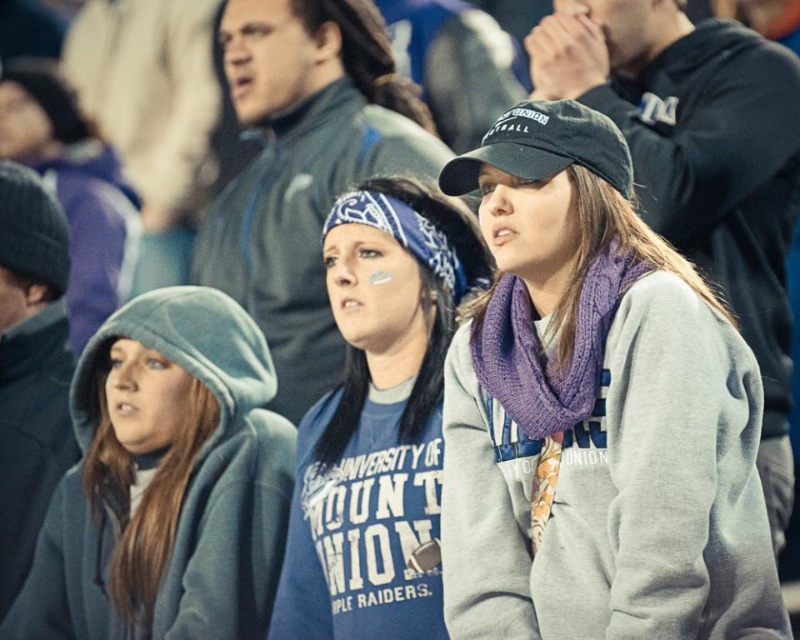
You are a photographer trying to capture a candid shot of the two women in the foreground. You notice a purple knit scarf at center and a blue fabric shirt at center. Which item should you focus on if you want to ensure the subject fills the frame without cropping, considering their widths?

The purple knit scarf at center might be wider than blue fabric shirt at center, so focusing on the purple knit scarf at center would be better to ensure the subject fills the frame without cropping due to its potential width.